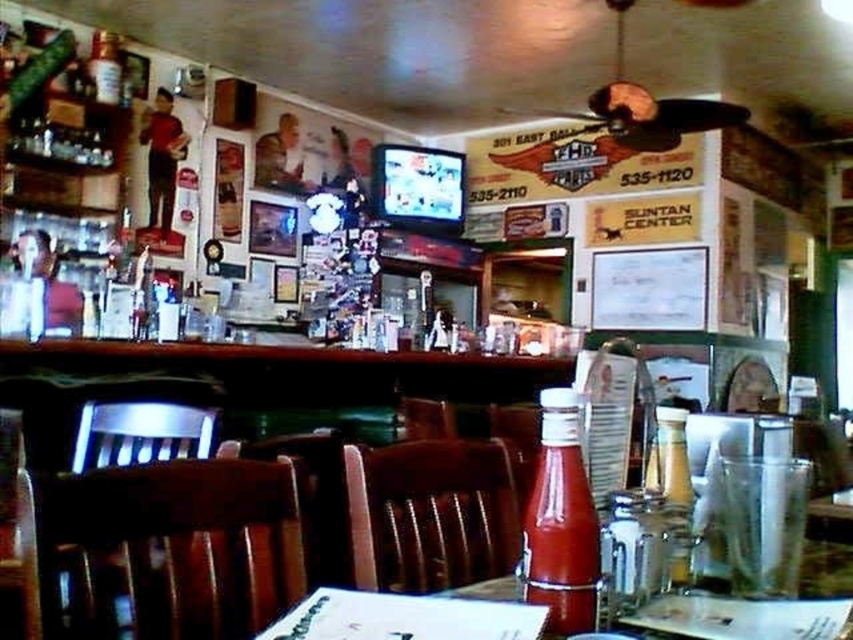
Question: Is the position of clear glass bottle at center less distant than that of glassy plastic ketchup bottle at center?

Choices:
 (A) no
 (B) yes

Answer: (B)

Question: Can you confirm if brown wood chair at lower left is thinner than matte glass bottle at center?

Choices:
 (A) no
 (B) yes

Answer: (A)

Question: Which point is closer to the camera taking this photo?

Choices:
 (A) (419, 550)
 (B) (660, 483)
 (C) (276, 545)
 (D) (549, 582)

Answer: (D)

Question: Which of the following is the farthest from the observer?

Choices:
 (A) glassy plastic ketchup bottle at center
 (B) matte glass bottle at center
 (C) brown wood chair at lower left

Answer: (A)

Question: Does brown leather chair at center have a smaller size compared to clear glass bottle at center?

Choices:
 (A) no
 (B) yes

Answer: (A)

Question: Among these points, which one is nearest to the camera?

Choices:
 (A) (531, 522)
 (B) (175, 596)

Answer: (A)